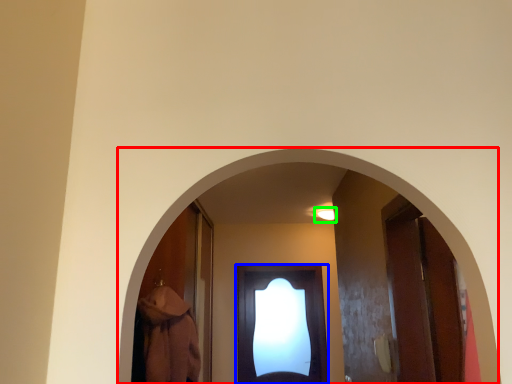
Question: Which object is positioned farthest from archway (highlighted by a red box)? Select from door (highlighted by a blue box) and light (highlighted by a green box).

Choices:
 (A) door
 (B) light

Answer: (A)